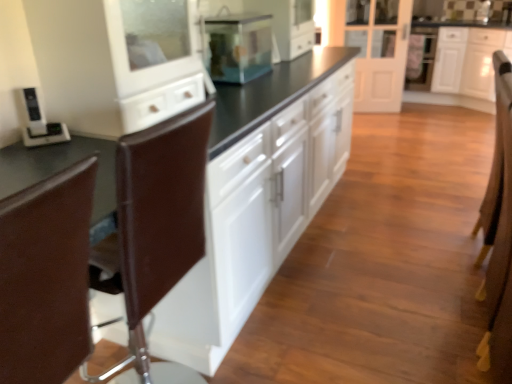
Where is `empty space that is ontop of white glossy door at center (from a real-world perspective)`? empty space that is ontop of white glossy door at center (from a real-world perspective) is located at coordinates (364, 0).